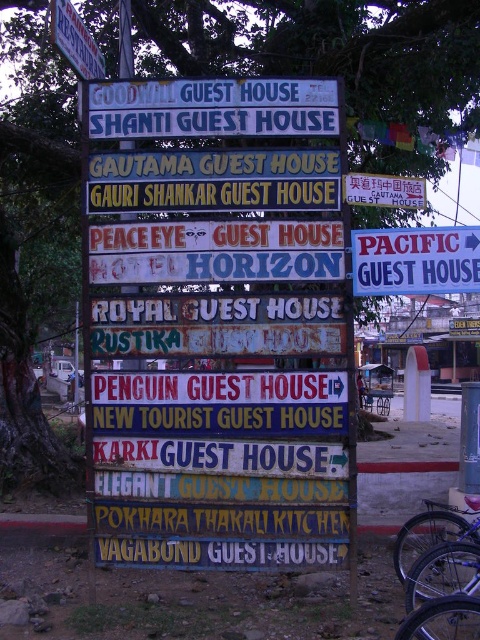
Which is more to the right, white plastic sign at right or brushed metal sign at upper left?

From the viewer's perspective, white plastic sign at right appears more on the right side.

Between point (372, 236) and point (79, 22), which one is positioned in front?

Positioned in front is point (372, 236).

Is point (460, 268) more distant than point (75, 45)?

No, it is not.

The image size is (480, 640). I want to click on white plastic sign at right, so click(x=416, y=260).

Between point (159, 118) and point (443, 289), which one is positioned in front?

Point (443, 289) is in front.

The width and height of the screenshot is (480, 640). Find the location of `white painted wood sign at upper center`. white painted wood sign at upper center is located at coordinates (213, 108).

Is point (123, 108) more distant than point (60, 17)?

Yes.

Which of these two, white painted wood sign at upper center or brushed metal sign at upper left, stands shorter?

With less height is white painted wood sign at upper center.

Who is more distant from viewer, (261, 124) or (93, 38)?

Positioned behind is point (93, 38).

The image size is (480, 640). I want to click on white painted wood sign at upper center, so click(x=213, y=108).